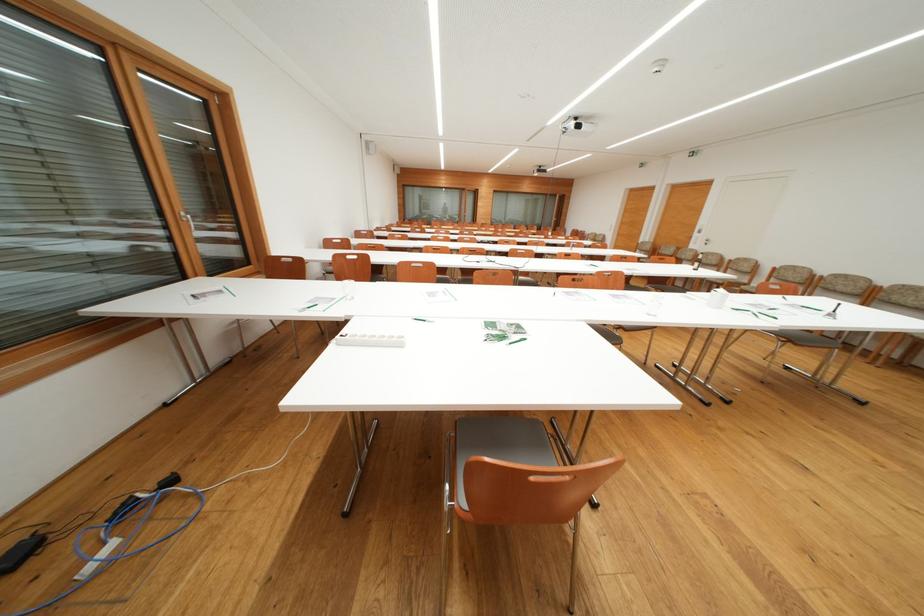
Where would you push the silver table bell? Please return your answer as a coordinate pair (x, y).

(833, 312)